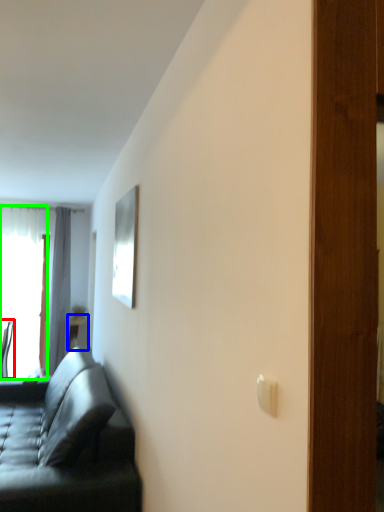
Question: Considering the real-world distances, which object is closest to chair (highlighted by a red box)? table (highlighted by a blue box) or window (highlighted by a green box).

Choices:
 (A) table
 (B) window

Answer: (B)